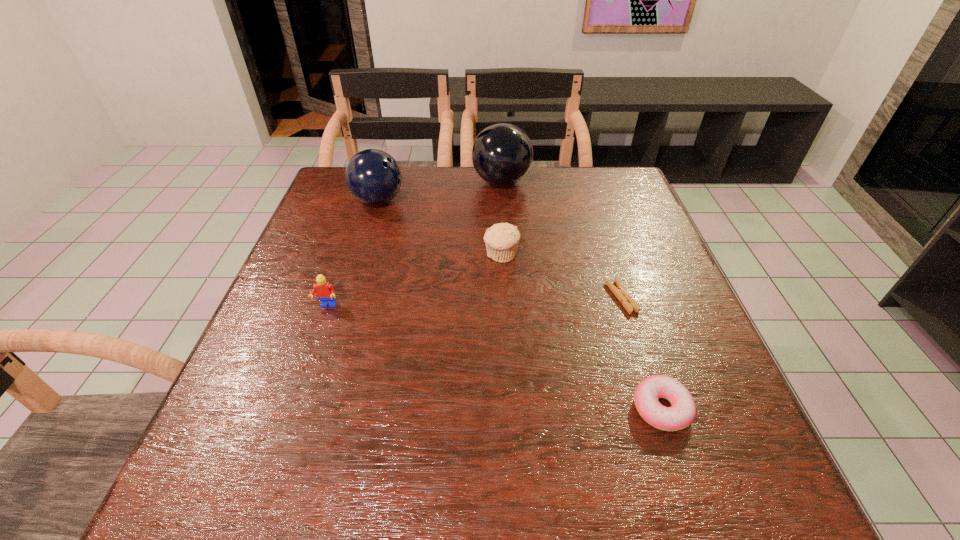
The image size is (960, 540). What are the coordinates of `vacant area in the image that satisfies the following two spatial constraints: 1. on the surface of the clothespin near the finger holes; 2. on the right side of the left bowling ball` in the screenshot? It's located at (348, 298).

The height and width of the screenshot is (540, 960). I want to click on free point that satisfies the following two spatial constraints: 1. on the front side of the clothespin; 2. on the right side of the doughnut, so click(x=658, y=408).

Where is `vacant space that satisfies the following two spatial constraints: 1. on the surface of the muffin near the finger holes; 2. on the left side of the left bowling ball`? Image resolution: width=960 pixels, height=540 pixels. vacant space that satisfies the following two spatial constraints: 1. on the surface of the muffin near the finger holes; 2. on the left side of the left bowling ball is located at coordinates pos(362,255).

The width and height of the screenshot is (960, 540). I want to click on vacant space that satisfies the following two spatial constraints: 1. on the front side of the fourth nearest object; 2. on the right side of the clothespin, so click(x=503, y=298).

Find the location of a particular element. free space that satisfies the following two spatial constraints: 1. on the surface of the shorter bowling ball near the finger holes; 2. on the left side of the clothespin is located at coordinates (348, 298).

Where is `vacant space that satisfies the following two spatial constraints: 1. on the side of the right bowling ball with the finger holes; 2. on the right side of the nearest object`? vacant space that satisfies the following two spatial constraints: 1. on the side of the right bowling ball with the finger holes; 2. on the right side of the nearest object is located at coordinates (516, 408).

Locate an element on the screen. Image resolution: width=960 pixels, height=540 pixels. free region that satisfies the following two spatial constraints: 1. on the front side of the third farthest object; 2. on the left side of the shortest object is located at coordinates (503, 298).

You are a GUI agent. You are given a task and a screenshot of the screen. Output one action in this format:
    pyautogui.click(x=<x>, y=<y>)
    Task: Click on the free point that satisfies the following two spatial constraints: 1. on the front side of the second shortest object; 2. on the right side of the muffin
    This screenshot has height=540, width=960.
    Given the screenshot: What is the action you would take?
    pyautogui.click(x=509, y=408)